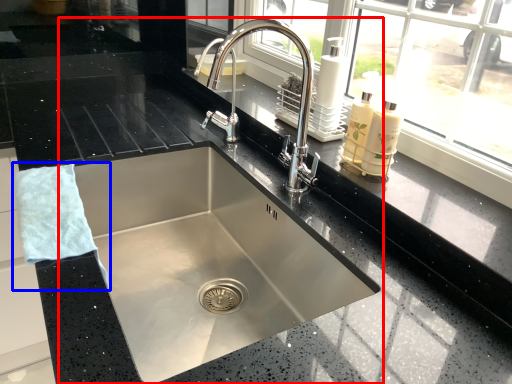
Question: Which of the following is the closest to the observer, sink (highlighted by a red box) or hand towel (highlighted by a blue box)?

Choices:
 (A) sink
 (B) hand towel

Answer: (A)